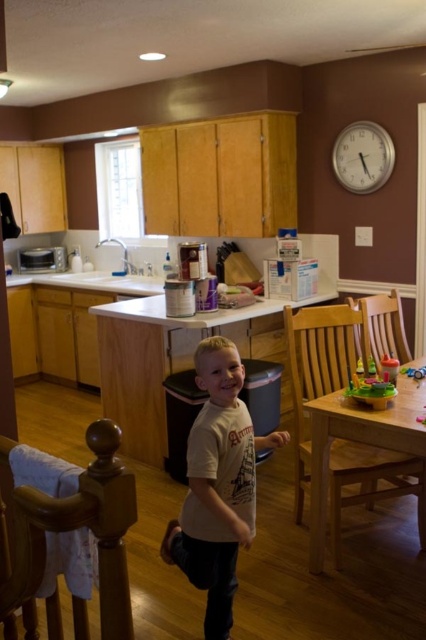
Does wooden chair at lower left appear on the right side of translucent plastic toy at table?

No, wooden chair at lower left is not to the right of translucent plastic toy at table.

Identify the location of wooden chair at lower left. This screenshot has height=640, width=426. [77, 528].

Can you confirm if light beige cotton shirt at center is thinner than wooden chair at lower left?

Incorrect, light beige cotton shirt at center's width is not less than wooden chair at lower left's.

Looking at this image, who is positioned more to the right, light beige cotton shirt at center or wooden chair at lower left?

light beige cotton shirt at center is more to the right.

Is point (222, 524) positioned behind point (111, 628)?

Yes, it is behind point (111, 628).

Identify the location of light beige cotton shirt at center. (218, 484).

Image resolution: width=426 pixels, height=640 pixels. What do you see at coordinates (218, 484) in the screenshot?
I see `light beige cotton shirt at center` at bounding box center [218, 484].

Who is taller, light beige cotton shirt at center or light brown wooden table at lower right?

Answer: light beige cotton shirt at center

This screenshot has width=426, height=640. In order to click on light beige cotton shirt at center in this screenshot , I will do `click(218, 484)`.